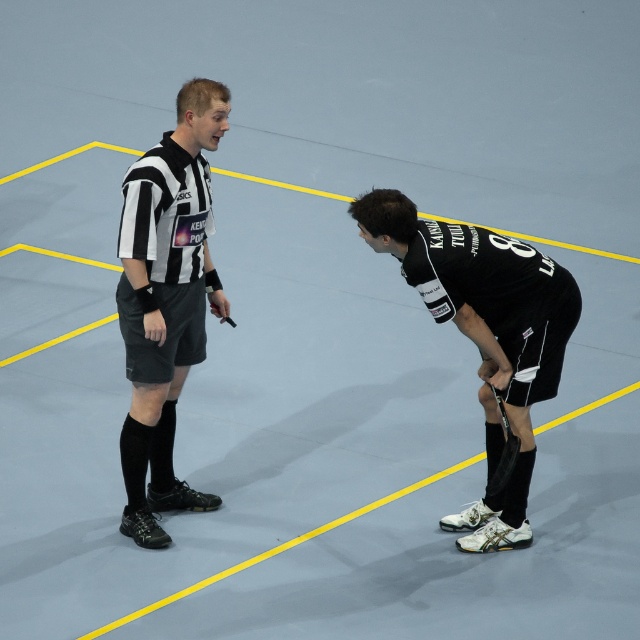
Is black/white striped shirt at center behind black matte hockey stick at lower right?

No.

Is point (116, 241) closer to camera compared to point (483, 524)?

No, (116, 241) is further to viewer.

Between point (152, 538) and point (426, 225), which one is positioned in front?

Point (426, 225)

In order to click on black/white striped shirt at center in this screenshot , I will do `click(166, 300)`.